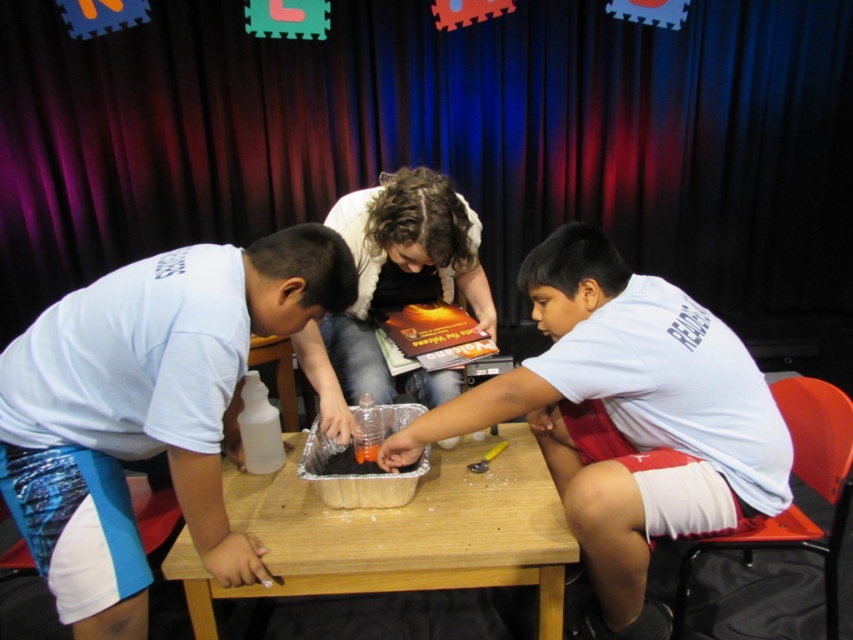
Question: Which of the following is the closest to the observer?

Choices:
 (A) white matte shirt at center
 (B) wooden table at center

Answer: (B)

Question: Does white matte shirt at center have a smaller size compared to wooden table at center?

Choices:
 (A) no
 (B) yes

Answer: (A)

Question: Which is nearer to the white matte shirt at left?

Choices:
 (A) white matte shirt at center
 (B) wooden table at center

Answer: (B)

Question: Can you confirm if white matte shirt at left is positioned to the right of wooden table at center?

Choices:
 (A) yes
 (B) no

Answer: (B)

Question: Does white matte shirt at left come behind white matte shirt at center?

Choices:
 (A) yes
 (B) no

Answer: (B)

Question: Which point appears farthest from the camera in this image?

Choices:
 (A) (225, 541)
 (B) (357, 550)

Answer: (B)